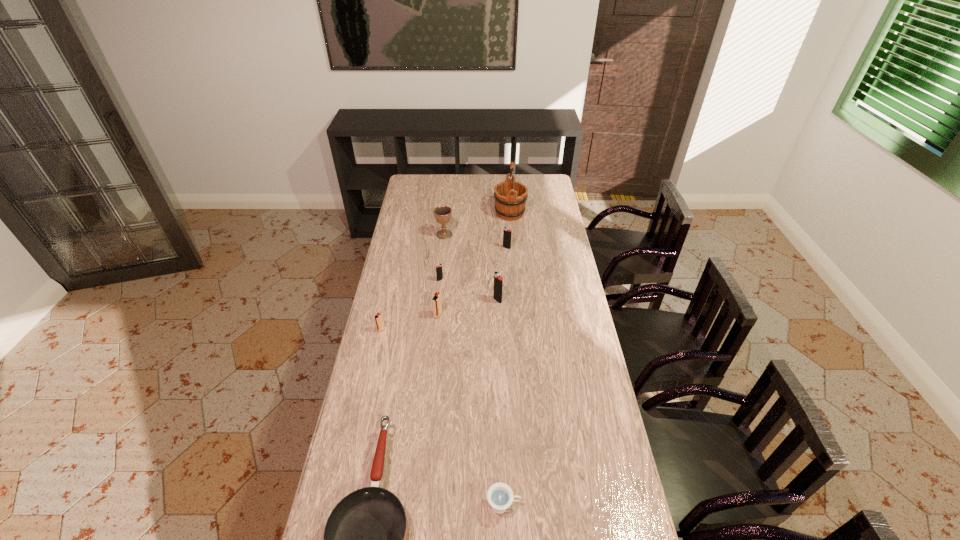
I want to click on vacant space located 0.360m on the front of the right red igniter, so click(x=430, y=395).

Identify the location of vacant space located on the front of the third nearest object. The height and width of the screenshot is (540, 960). (375, 354).

At what (x,y) coordinates should I click in order to perform the action: click on vacant space situated 0.340m on the right of the leftmost black igniter. Please return your answer as a coordinate pair (x, y). The height and width of the screenshot is (540, 960). Looking at the image, I should click on (519, 280).

Locate an element on the screen. The image size is (960, 540). blank space located on the side of the blue teacup with the handle is located at coordinates (552, 505).

Identify the location of object that is at the left edge. (379, 322).

This screenshot has height=540, width=960. What are the coordinates of `vacant space at the left edge of the desktop` in the screenshot? It's located at (396, 282).

You are a GUI agent. You are given a task and a screenshot of the screen. Output one action in this format:
    pyautogui.click(x=<x>, y=<y>)
    Task: Click on the vacant space at the right edge of the desktop
    The image size is (960, 540).
    Given the screenshot: What is the action you would take?
    pyautogui.click(x=553, y=269)

What are the coordinates of `vacant area at the far right corner` in the screenshot? It's located at (550, 181).

At what (x,y) coordinates should I click in order to perform the action: click on empty location between the nearer red igniter and the farther red igniter. Please return your answer as a coordinate pair (x, y). The height and width of the screenshot is (540, 960). Looking at the image, I should click on (410, 322).

Image resolution: width=960 pixels, height=540 pixels. Find the location of `empty space that is in between the biggest black igniter and the farthest igniter`. empty space that is in between the biggest black igniter and the farthest igniter is located at coordinates (502, 274).